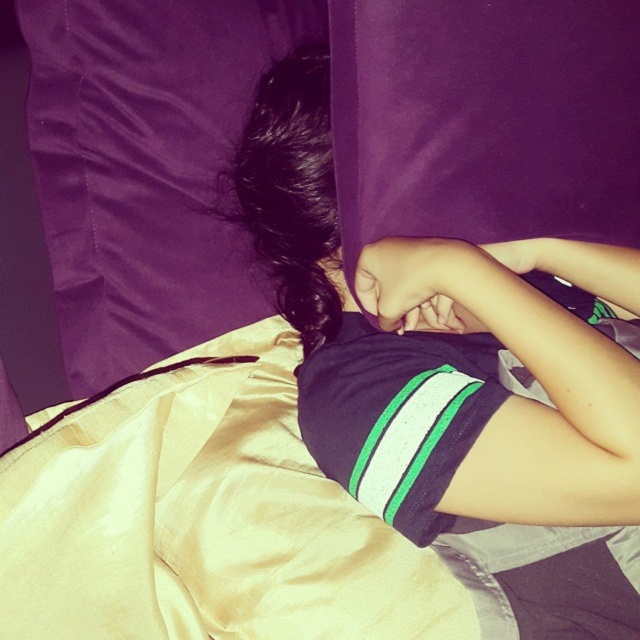
Question: Is purple satin pillow at upper left to the left of purple satin pillow at upper center from the viewer's perspective?

Choices:
 (A) yes
 (B) no

Answer: (A)

Question: Based on their relative distances, which object is farther from the purple satin pillow at upper left?

Choices:
 (A) purple satin pillow at upper center
 (B) beige satin blanket at center

Answer: (A)

Question: Which point is farther from the camera taking this photo?

Choices:
 (A) (200, 433)
 (B) (632, 410)
 (C) (88, 298)

Answer: (C)

Question: Which point appears closest to the camera in this image?

Choices:
 (A) (476, 410)
 (B) (232, 28)
 (C) (452, 195)

Answer: (A)

Question: Is black jersey at center in front of purple satin pillow at upper left?

Choices:
 (A) yes
 (B) no

Answer: (A)

Question: Where is black jersey at center located in relation to purple satin pillow at upper left in the image?

Choices:
 (A) below
 (B) above

Answer: (A)